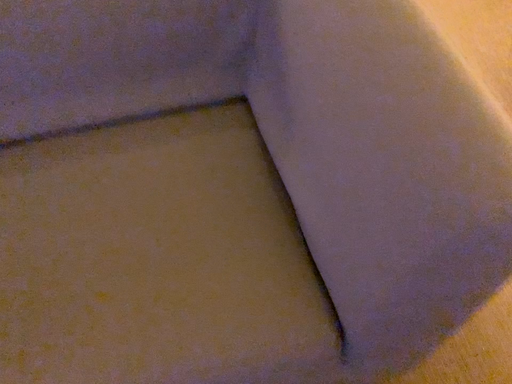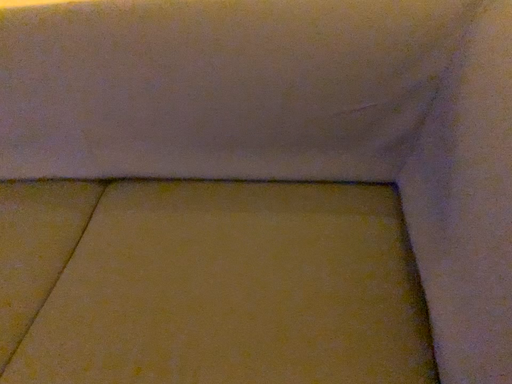
Question: How did the camera likely rotate when shooting the video?

Choices:
 (A) rotated downward
 (B) rotated upward

Answer: (B)